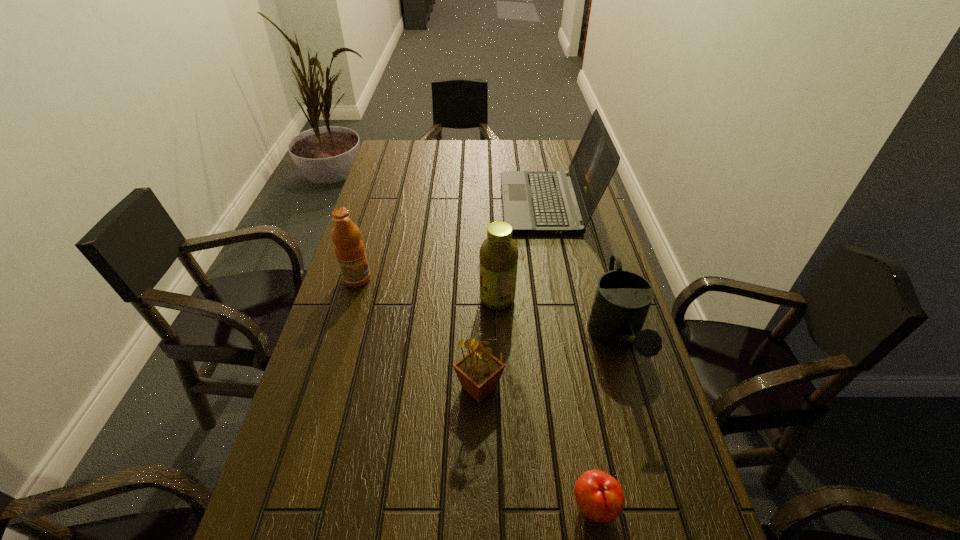
What are the coordinates of `apple positioned at the right edge` in the screenshot? It's located at (599, 496).

In order to click on vacant region at the left edge of the desktop in this screenshot , I will do `click(330, 337)`.

Image resolution: width=960 pixels, height=540 pixels. Identify the location of blank space at the right edge of the desktop. click(x=675, y=435).

In the image, there is a desktop. At what (x,y) coordinates should I click in order to perform the action: click on vacant space at the far left corner. Please return your answer as a coordinate pair (x, y). Looking at the image, I should click on (402, 142).

The image size is (960, 540). In order to click on free space at the far right corner in this screenshot , I will do `click(540, 156)`.

The image size is (960, 540). Identify the location of free space between the right fruit juice and the left fruit juice. (427, 289).

Find the location of `free space that is in between the shortest object and the watering can`. free space that is in between the shortest object and the watering can is located at coordinates (606, 423).

Identify the location of unoccupied area between the sunflower and the leftmost object. The width and height of the screenshot is (960, 540). (419, 333).

You are a GUI agent. You are given a task and a screenshot of the screen. Output one action in this format:
    pyautogui.click(x=<x>, y=<y>)
    Task: Click on the free area in between the farthest object and the right fruit juice
    
    Given the screenshot: What is the action you would take?
    pyautogui.click(x=522, y=252)

Locate an element on the screen. The height and width of the screenshot is (540, 960). vacant area between the apple and the right fruit juice is located at coordinates (546, 403).